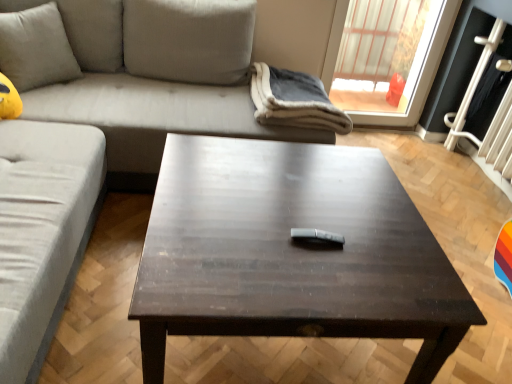
Question: Is suede gray couch at upper left, which ranks as the 1th studio couch in front-to-back order, aimed at soft beige cushion at upper left?

Choices:
 (A) no
 (B) yes

Answer: (A)

Question: Considering the relative positions of suede gray couch at upper left, acting as the 2th studio couch starting from the back, and soft beige cushion at upper left in the image provided, is suede gray couch at upper left, acting as the 2th studio couch starting from the back, to the left of soft beige cushion at upper left from the viewer's perspective?

Choices:
 (A) no
 (B) yes

Answer: (A)

Question: Is soft beige cushion at upper left surrounded by suede gray couch at upper left, acting as the 2th studio couch starting from the back?

Choices:
 (A) no
 (B) yes

Answer: (B)

Question: Can you confirm if suede gray couch at upper left, acting as the 2th studio couch starting from the back, is smaller than soft beige cushion at upper left?

Choices:
 (A) yes
 (B) no

Answer: (B)

Question: Is suede gray couch at upper left, which ranks as the 1th studio couch in front-to-back order, turned away from soft beige cushion at upper left?

Choices:
 (A) yes
 (B) no

Answer: (A)

Question: Can you confirm if suede gray couch at upper left, acting as the 2th studio couch starting from the back, is wider than soft beige cushion at upper left?

Choices:
 (A) yes
 (B) no

Answer: (A)

Question: Does dark wood/black table at center have a greater width compared to light gray fabric couch at upper left, the second studio couch positioned from the front?

Choices:
 (A) yes
 (B) no

Answer: (A)

Question: From the image's perspective, is dark wood/black table at center located beneath light gray fabric couch at upper left, the second studio couch positioned from the front?

Choices:
 (A) no
 (B) yes

Answer: (B)

Question: Is dark wood/black table at center oriented away from light gray fabric couch at upper left, the second studio couch positioned from the front?

Choices:
 (A) no
 (B) yes

Answer: (A)

Question: Can you confirm if dark wood/black table at center is bigger than light gray fabric couch at upper left, the second studio couch positioned from the front?

Choices:
 (A) no
 (B) yes

Answer: (A)

Question: From a real-world perspective, does dark wood/black table at center stand above light gray fabric couch at upper left, the second studio couch positioned from the front?

Choices:
 (A) yes
 (B) no

Answer: (B)

Question: Does dark wood/black table at center have a lesser width compared to light gray fabric couch at upper left, which appears as the 1th studio couch when viewed from the back?

Choices:
 (A) no
 (B) yes

Answer: (A)

Question: Are light gray fabric couch at upper left, the second studio couch positioned from the front, and soft gray fleece blanket at upper center beside each other?

Choices:
 (A) yes
 (B) no

Answer: (B)